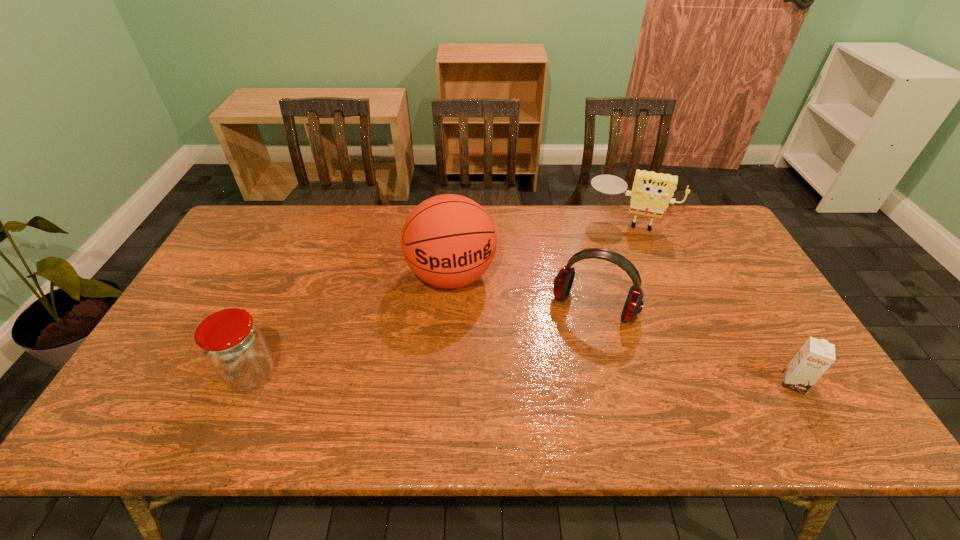
The height and width of the screenshot is (540, 960). Find the location of `vacant space on the desktop that is between the leftmost object and the shortest object and is positioned on the front-facing side of the farthest object`. vacant space on the desktop that is between the leftmost object and the shortest object and is positioned on the front-facing side of the farthest object is located at coordinates (599, 380).

Find the location of a particular element. The width and height of the screenshot is (960, 540). free space on the desktop that is between the leftmost object and the shortest object and is positioned on the side with logo of the second object from left to right is located at coordinates (478, 378).

Where is `free space on the desktop that is between the jar and the chocolate milk and is positioned on the ear cups of the earphone`? free space on the desktop that is between the jar and the chocolate milk and is positioned on the ear cups of the earphone is located at coordinates (564, 379).